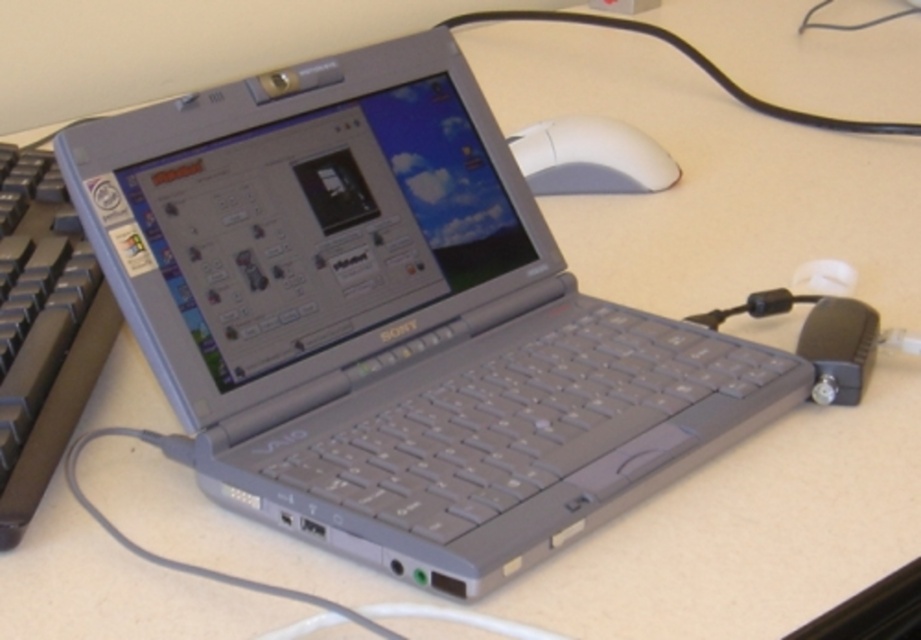
Question: Is gray plastic keyboard at left in front of white matte mouse at upper right?

Choices:
 (A) no
 (B) yes

Answer: (B)

Question: Is gray plastic keyboard at left in front of white matte mouse at upper right?

Choices:
 (A) yes
 (B) no

Answer: (A)

Question: Which object is closer to the camera taking this photo?

Choices:
 (A) white matte mouse at upper right
 (B) gray plastic keyboard at left

Answer: (B)

Question: Which point is farther to the camera?

Choices:
 (A) gray plastic keyboard at left
 (B) white matte mouse at upper right

Answer: (B)

Question: Which of the following is the farthest from the observer?

Choices:
 (A) (68, 268)
 (B) (605, 180)

Answer: (B)

Question: Is gray plastic keyboard at left to the left of white matte mouse at upper right from the viewer's perspective?

Choices:
 (A) no
 (B) yes

Answer: (B)